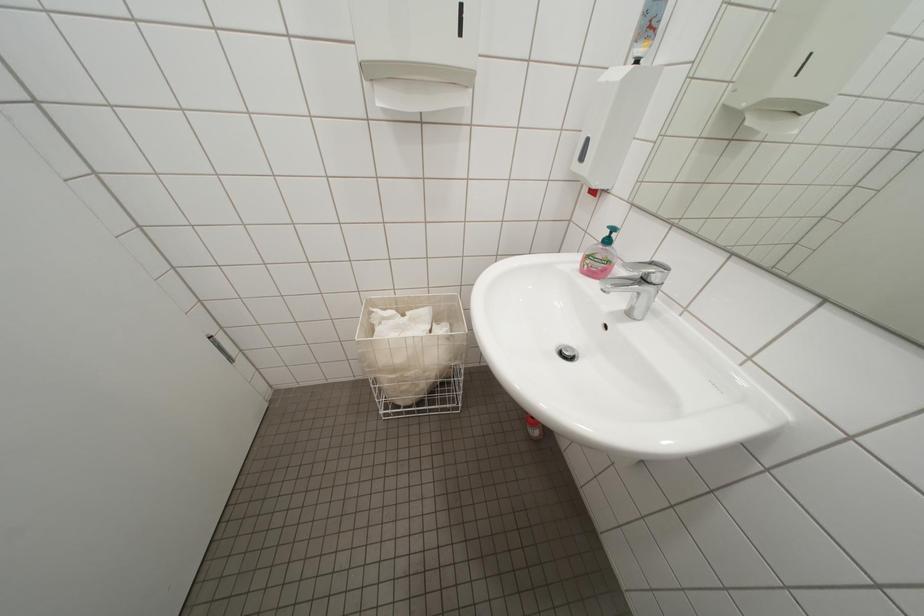
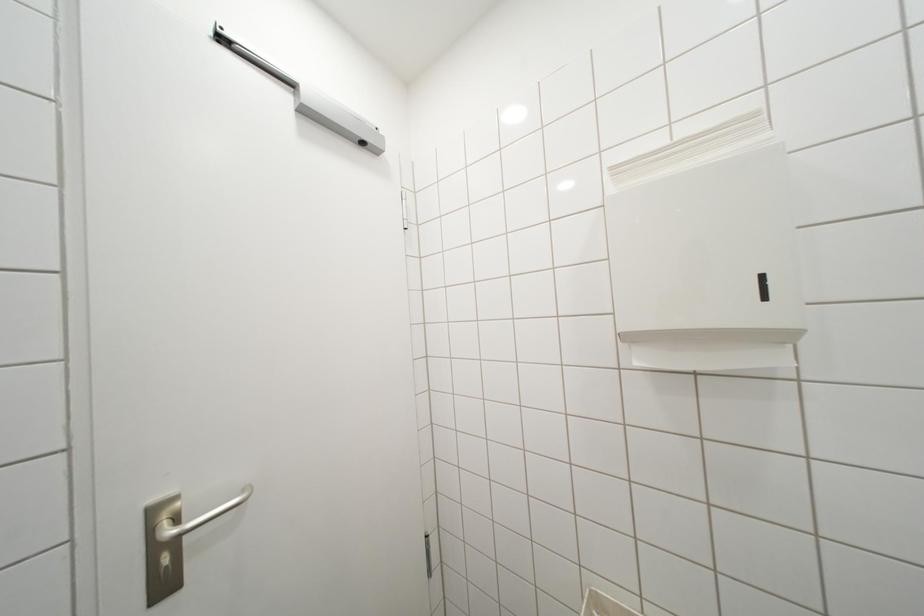
First-person continuous shooting, in which direction is the camera rotating?

The camera's rotation is toward left-up.